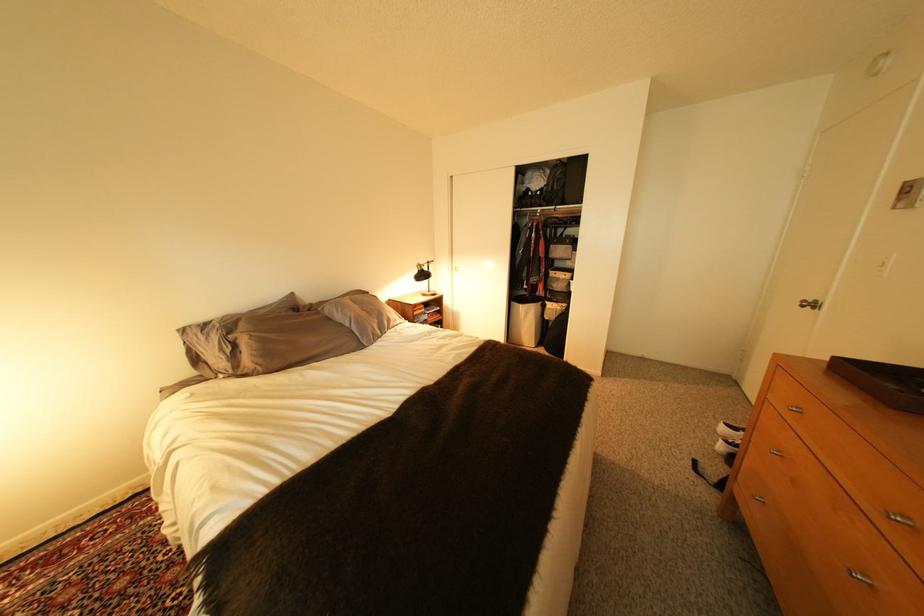
Where would you lift the gray pillow? Please return your answer as a coordinate pair (x, y).

(361, 315)